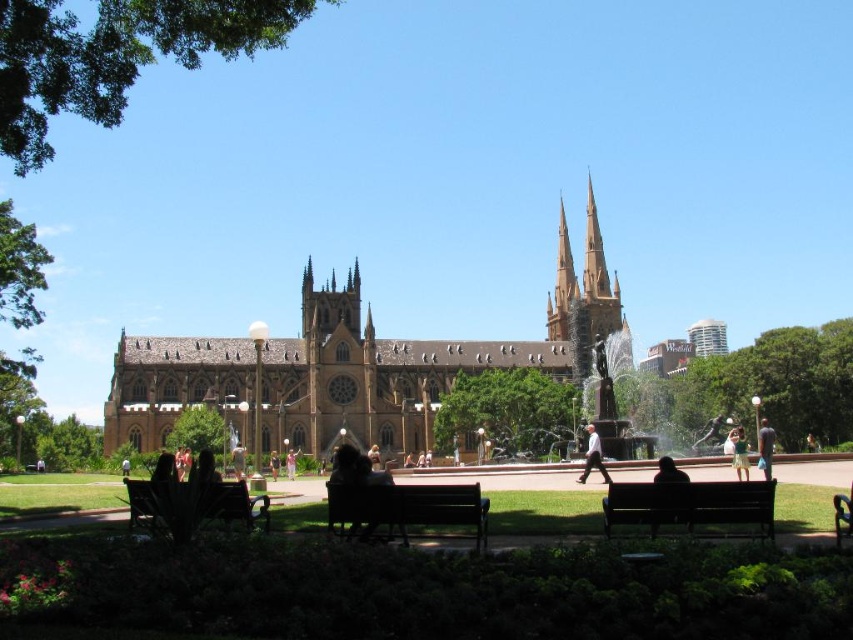
Question: Is green fabric dress at center in front of dark brown hair at lower center?

Choices:
 (A) no
 (B) yes

Answer: (A)

Question: Estimate the real-world distances between objects in this image. Which object is closer to the wooden bench at lower left?

Choices:
 (A) brown hair at center
 (B) green fabric dress at center

Answer: (A)

Question: Is pink fabric dress at center further to camera compared to light brown hair at center?

Choices:
 (A) no
 (B) yes

Answer: (B)

Question: Among these points, which one is farthest from the camera?

Choices:
 (A) (686, 509)
 (B) (123, 468)
 (C) (292, 458)
 (D) (592, 451)

Answer: (D)

Question: Which object is the farthest from the pink fabric dress at center?

Choices:
 (A) wooden bench at lower center
 (B) wooden bench at lower left
 (C) brown hair at center

Answer: (A)

Question: In this image, where is wooden bench at center located relative to green fabric dress at center?

Choices:
 (A) below
 (B) above

Answer: (A)